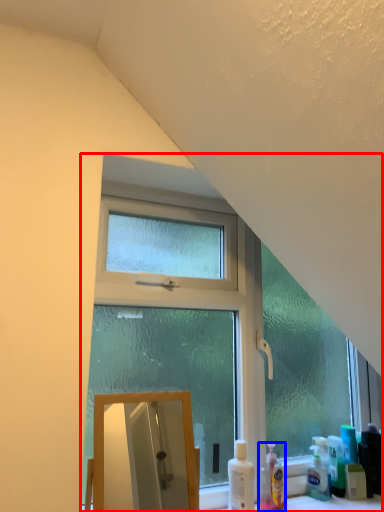
Question: Which point is further to the camera, window (highlighted by a red box) or cleaning product (highlighted by a blue box)?

Choices:
 (A) window
 (B) cleaning product

Answer: (B)